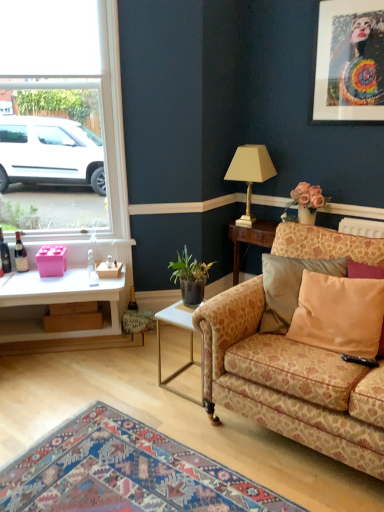
Question: Can you confirm if white glass window at upper left is wider than brown cardboard box at lower left, placed as the 2th box when sorted from top to bottom?

Choices:
 (A) yes
 (B) no

Answer: (B)

Question: Is white glass window at upper left not within brown cardboard box at lower left, the 1th box from the bottom?

Choices:
 (A) no
 (B) yes

Answer: (B)

Question: Is brown cardboard box at lower left, placed as the 2th box when sorted from top to bottom, located within white glass window at upper left?

Choices:
 (A) yes
 (B) no

Answer: (B)

Question: Is white glass window at upper left placed right next to brown cardboard box at lower left, placed as the 2th box when sorted from top to bottom?

Choices:
 (A) yes
 (B) no

Answer: (B)

Question: Considering the relative sizes of white glass window at upper left and brown cardboard box at lower left, the 1th box from the bottom, in the image provided, is white glass window at upper left shorter than brown cardboard box at lower left, the 1th box from the bottom,?

Choices:
 (A) yes
 (B) no

Answer: (B)

Question: In terms of width, does brown cardboard box at lower left, placed as the 2th box when sorted from top to bottom, look wider or thinner when compared to gold metallic lamp at upper center?

Choices:
 (A) thin
 (B) wide

Answer: (A)

Question: Would you say brown cardboard box at lower left, placed as the 2th box when sorted from top to bottom, is to the left or to the right of gold metallic lamp at upper center in the picture?

Choices:
 (A) right
 (B) left

Answer: (B)

Question: Is brown cardboard box at lower left, the 1th box from the bottom, in front of or behind gold metallic lamp at upper center in the image?

Choices:
 (A) front
 (B) behind

Answer: (B)

Question: Is brown cardboard box at lower left, the 1th box from the bottom, situated inside gold metallic lamp at upper center or outside?

Choices:
 (A) outside
 (B) inside

Answer: (A)

Question: Looking at their shapes, would you say gold metallic lamp at upper center is wider or thinner than pink matte plastic box at left, which is the first box in top-to-bottom order?

Choices:
 (A) thin
 (B) wide

Answer: (B)

Question: From the image's perspective, is gold metallic lamp at upper center located above or below pink matte plastic box at left, the second box in the bottom-to-top sequence?

Choices:
 (A) below
 (B) above

Answer: (B)

Question: In the image, is gold metallic lamp at upper center positioned in front of or behind pink matte plastic box at left, which is the first box in top-to-bottom order?

Choices:
 (A) front
 (B) behind

Answer: (B)

Question: From a real-world perspective, is gold metallic lamp at upper center above or below pink matte plastic box at left, which is the first box in top-to-bottom order?

Choices:
 (A) above
 (B) below

Answer: (A)

Question: From a real-world perspective, is green leafy plant in pot at center above or below brown cardboard box at lower left, placed as the 2th box when sorted from top to bottom?

Choices:
 (A) below
 (B) above

Answer: (B)

Question: Looking at their shapes, would you say green leafy plant in pot at center is wider or thinner than brown cardboard box at lower left, the 1th box from the bottom?

Choices:
 (A) thin
 (B) wide

Answer: (B)